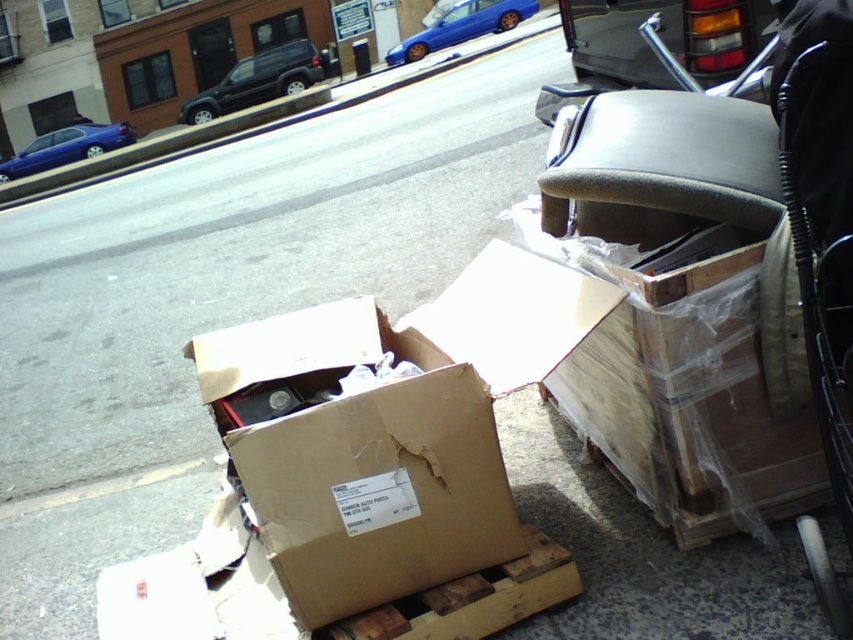
Question: Which is nearer to the brown cardboard box at center?

Choices:
 (A) blue glossy sedan at upper center
 (B) metallic gray tail light at upper right

Answer: (B)

Question: Estimate the real-world distances between objects in this image. Which object is closer to the black matte suv at upper left?

Choices:
 (A) brown cardboard box at center
 (B) metallic gray tail light at upper right
 (C) matte blue sedan at left

Answer: (C)

Question: Does brown cardboard box at center appear on the right side of metallic gray tail light at upper right?

Choices:
 (A) no
 (B) yes

Answer: (A)

Question: In this image, where is black matte suv at upper left located relative to matte blue sedan at left?

Choices:
 (A) left
 (B) right

Answer: (B)

Question: Which point is closer to the camera?

Choices:
 (A) blue glossy sedan at upper center
 (B) metallic gray tail light at upper right
 (C) brown cardboard box at center

Answer: (C)

Question: Is blue glossy sedan at upper center below matte blue sedan at left?

Choices:
 (A) yes
 (B) no

Answer: (B)